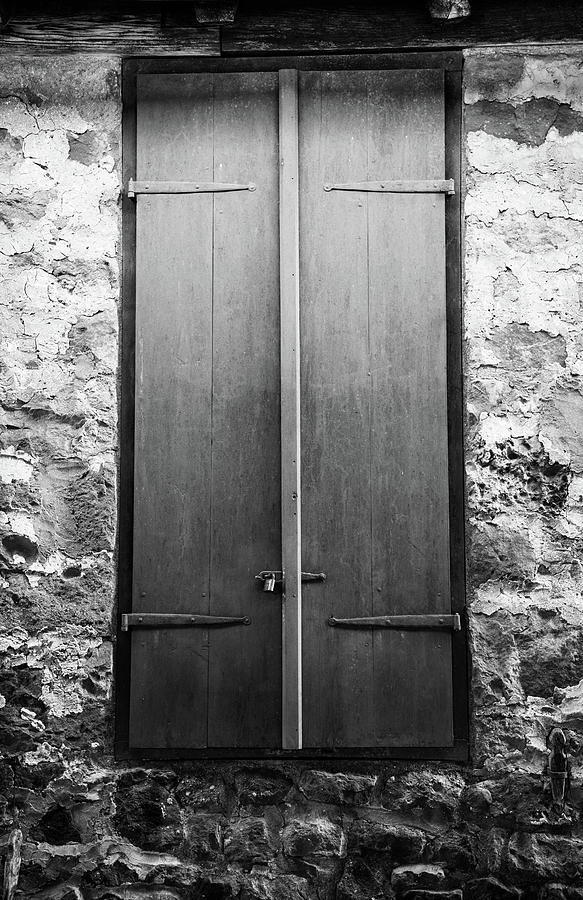
Locate an element on the screen. This screenshot has width=583, height=900. door frame is located at coordinates (129, 259), (231, 752), (458, 565), (351, 58).